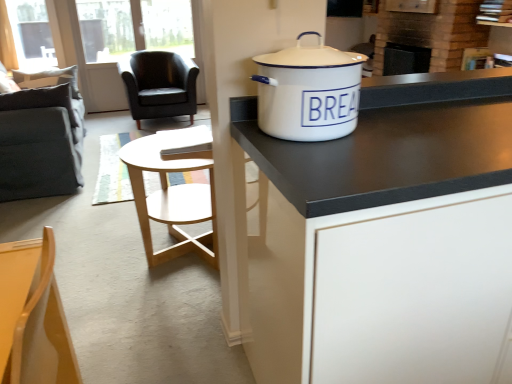
Question: Considering the positions of dark gray fabric swivel chair at left and wooden chair at lower left, the 1th chair from the bottom, in the image, is dark gray fabric swivel chair at left taller or shorter than wooden chair at lower left, the 1th chair from the bottom,?

Choices:
 (A) tall
 (B) short

Answer: (A)

Question: Based on their positions, is dark gray fabric swivel chair at left located to the left or right of wooden chair at lower left, acting as the 2th chair starting from the back?

Choices:
 (A) right
 (B) left

Answer: (B)

Question: Estimate the real-world distances between objects in this image. Which object is farther from the transparent plastic window screen at upper left?

Choices:
 (A) wooden chair at lower left, which ranks as the 1th chair in front-to-back order
 (B) dark gray fabric swivel chair at left
 (C) black matte cabinet at center
 (D) white enamel pot at upper right
 (E) black leather chair at upper left, arranged as the first chair when viewed from the top

Answer: (C)

Question: Considering the real-world distances, which object is closest to the white enamel pot at upper right?

Choices:
 (A) transparent plastic window screen at upper left
 (B) wooden chair at lower left, the second chair when ordered from left to right
 (C) black leather chair at upper left, the 2th chair when ordered from bottom to top
 (D) black matte cabinet at center
 (E) dark gray fabric swivel chair at left

Answer: (D)